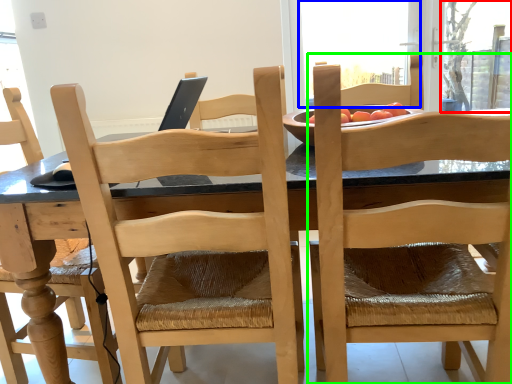
Question: Which is nearer to the window screen (highlighted by a red box)? window screen (highlighted by a blue box) or chair (highlighted by a green box).

Choices:
 (A) window screen
 (B) chair

Answer: (A)